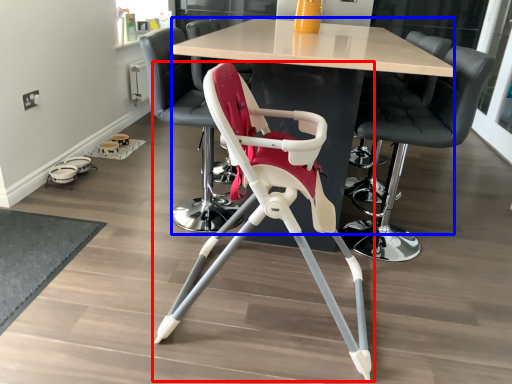
Question: Which point is further to the camera, chair (highlighted by a red box) or table (highlighted by a blue box)?

Choices:
 (A) chair
 (B) table

Answer: (B)